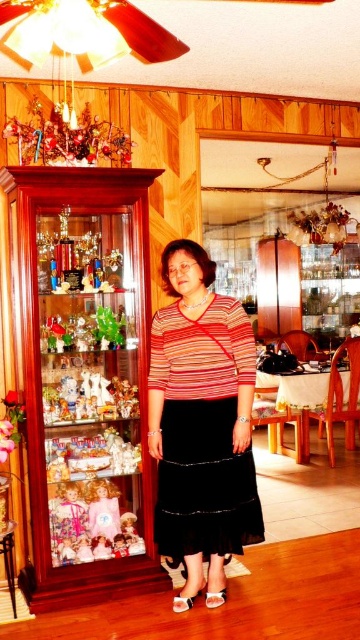
You are an interior designer planning to place a new lamp in this room. The lamp requires a spot with coordinates between 0.5 and 0.7 on the x and y axes. Is the area where the matte plastic doll at center is currently located suitable for placing the lamp?

The matte plastic doll at center is located at coordinates point (88, 397). Since both values fall within the required range of 0.5 to 0.7 on both axes, the area is suitable for placing the lamp.